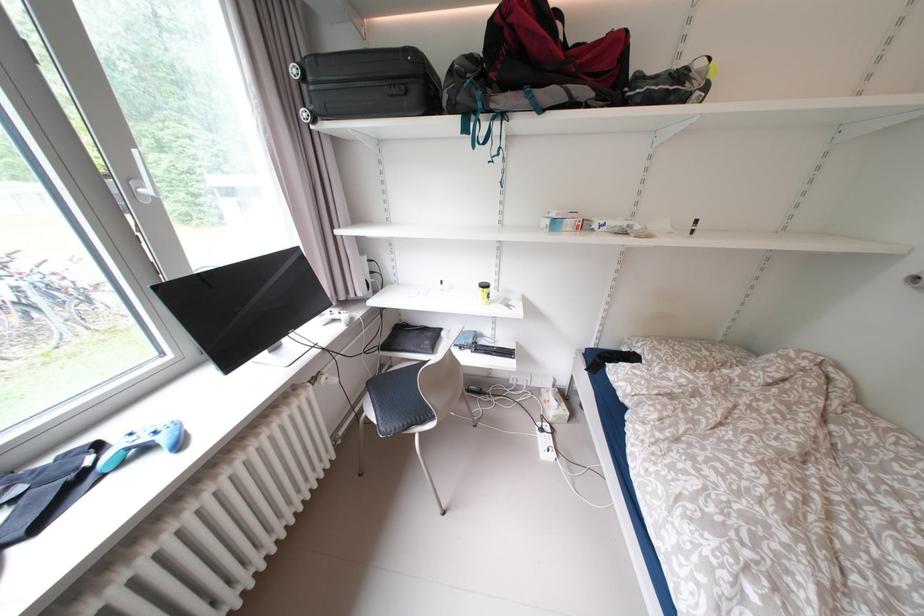
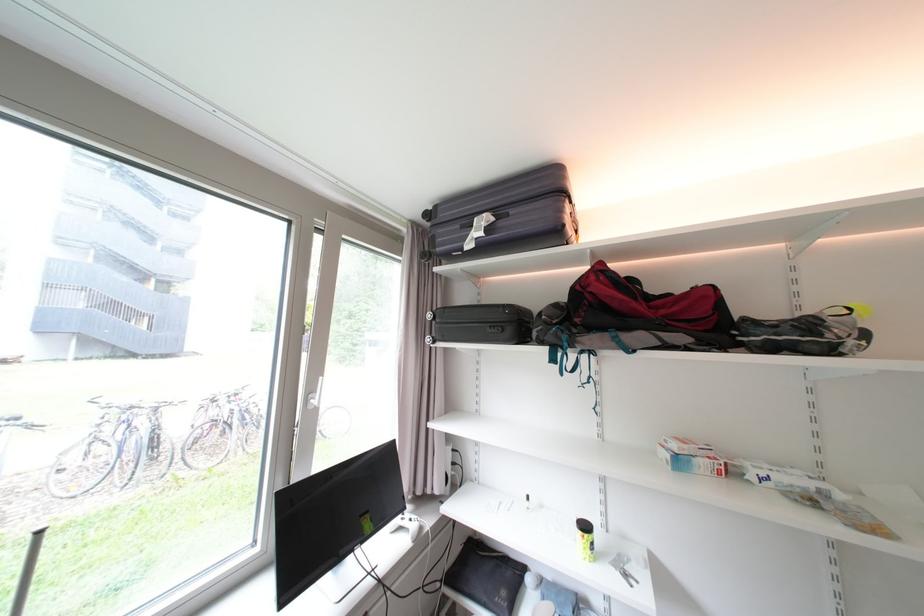
In the second image, find the point that corresponds to (410,89) in the first image.

(507, 330)